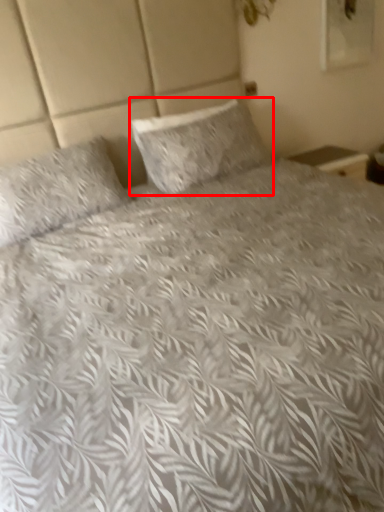
Question: Where is pillow (annotated by the red box) located in relation to pillow in the image?

Choices:
 (A) left
 (B) right

Answer: (B)